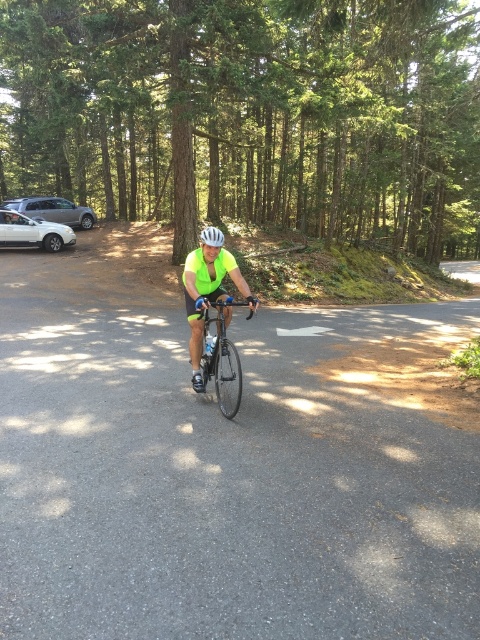
This screenshot has width=480, height=640. Describe the element at coordinates (207, 296) in the screenshot. I see `neon yellow jersey at center` at that location.

Does point (217, 248) come farther from viewer compared to point (210, 237)?

Yes, point (217, 248) is behind point (210, 237).

Identify the location of neon yellow jersey at center. The image size is (480, 640). (207, 296).

Between neon yellow jersey at center and white matte sedan at left, which one has more height?

white matte sedan at left

Does point (212, 291) come closer to viewer compared to point (6, 218)?

Yes, it is in front of point (6, 218).

Which is behind, point (227, 314) or point (60, 248)?

The point (60, 248) is more distant.

You are a GUI agent. You are given a task and a screenshot of the screen. Output one action in this format:
    pyautogui.click(x=<x>, y=<y>)
    Task: Click on the neon yellow jersey at center
    
    Given the screenshot: What is the action you would take?
    pyautogui.click(x=207, y=296)

Between white matte sedan at left and silver metallic sedan at left, which one has more height?

With more height is silver metallic sedan at left.

Who is more distant from viewer, (58,240) or (62,198)?

The point (62,198) is more distant.

Image resolution: width=480 pixels, height=640 pixels. I want to click on white matte sedan at left, so click(x=33, y=232).